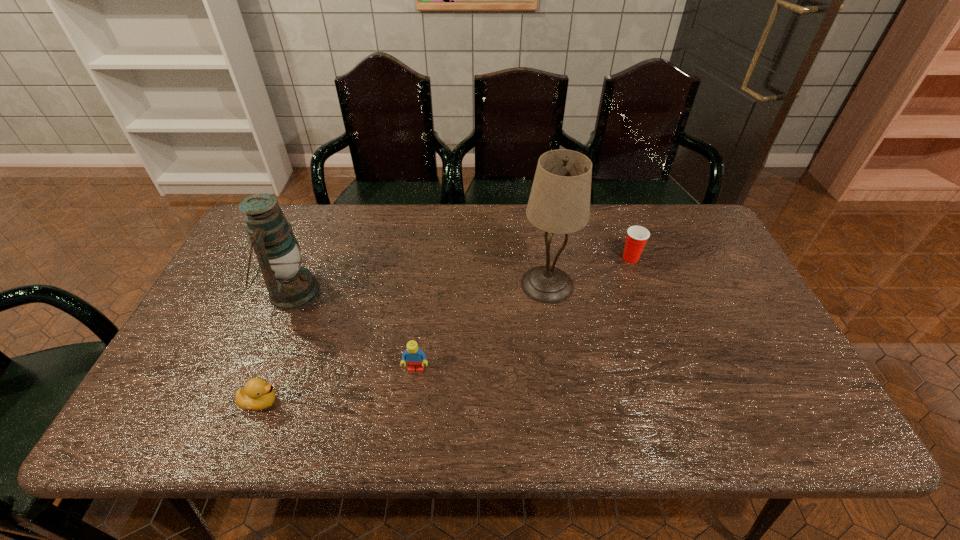
This screenshot has height=540, width=960. I want to click on free space between the fourth shortest object and the lampshade, so click(x=420, y=288).

In order to click on unoccupied area between the shortest object and the third object from left to right in this screenshot , I will do `click(338, 386)`.

This screenshot has width=960, height=540. In order to click on empty location between the duckling and the oil lamp in this screenshot , I will do `click(276, 347)`.

Where is `vacant space that is in between the tallest object and the third object from right to left`? The height and width of the screenshot is (540, 960). vacant space that is in between the tallest object and the third object from right to left is located at coordinates (482, 327).

The width and height of the screenshot is (960, 540). I want to click on free space that is in between the oil lamp and the shortest object, so click(276, 347).

Find the location of a particular element. vacant space in between the Lego and the oil lamp is located at coordinates (354, 331).

Locate an element on the screen. The height and width of the screenshot is (540, 960). free space between the third object from right to left and the tallest object is located at coordinates (482, 327).

I want to click on unoccupied area between the fourth shortest object and the fourth farthest object, so click(354, 331).

Where is `vacant point located between the Lego and the tallest object`? vacant point located between the Lego and the tallest object is located at coordinates [x=482, y=327].

This screenshot has height=540, width=960. I want to click on free space between the oil lamp and the farthest object, so click(462, 275).